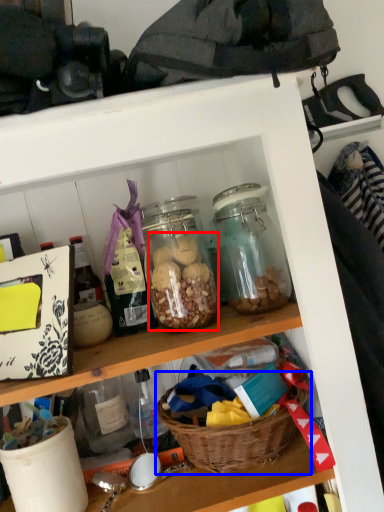
Question: Which object appears closest to the camera in this image, food (highlighted by a red box) or basket (highlighted by a blue box)?

Choices:
 (A) food
 (B) basket

Answer: (B)